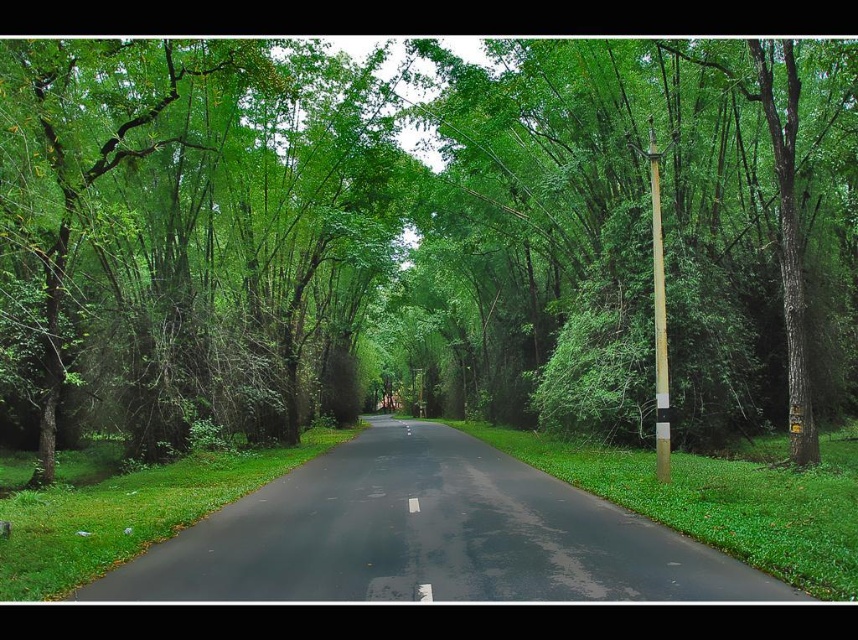
Who is taller, green leafy tree at left or brown wooden pole at right?

green leafy tree at left

Does green leafy tree at left have a greater height compared to brown wooden pole at right?

Yes, green leafy tree at left is taller than brown wooden pole at right.

Measure the distance between green leafy tree at left and camera.

green leafy tree at left is 32.66 feet away from camera.

Identify the location of green leafy tree at left. This screenshot has height=640, width=858. (189, 234).

Which is more to the left, green leafy tree at left or black asphalt road at center?

green leafy tree at left is more to the left.

Is green leafy tree at left closer to the viewer compared to black asphalt road at center?

That is False.

Is point (319, 392) positioned in front of point (252, 518)?

No, (319, 392) is further to viewer.

Locate an element on the screen. The height and width of the screenshot is (640, 858). green leafy tree at left is located at coordinates (189, 234).

Consider the image. Is green leafy tree at center closer to the viewer compared to black asphalt road at center?

No, it is behind black asphalt road at center.

Between point (176, 272) and point (357, 564), which one is positioned behind?

Point (176, 272)

Where is `green leafy tree at center`? This screenshot has height=640, width=858. green leafy tree at center is located at coordinates (402, 209).